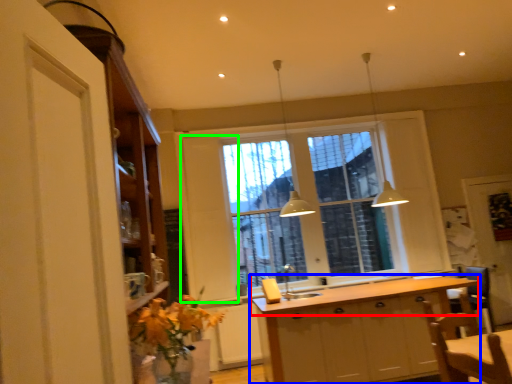
Question: Considering the real-world distances, which object is farthest from countertop (highlighted by a red box)? cabinetry (highlighted by a blue box) or screen door (highlighted by a green box)?

Choices:
 (A) cabinetry
 (B) screen door

Answer: (B)